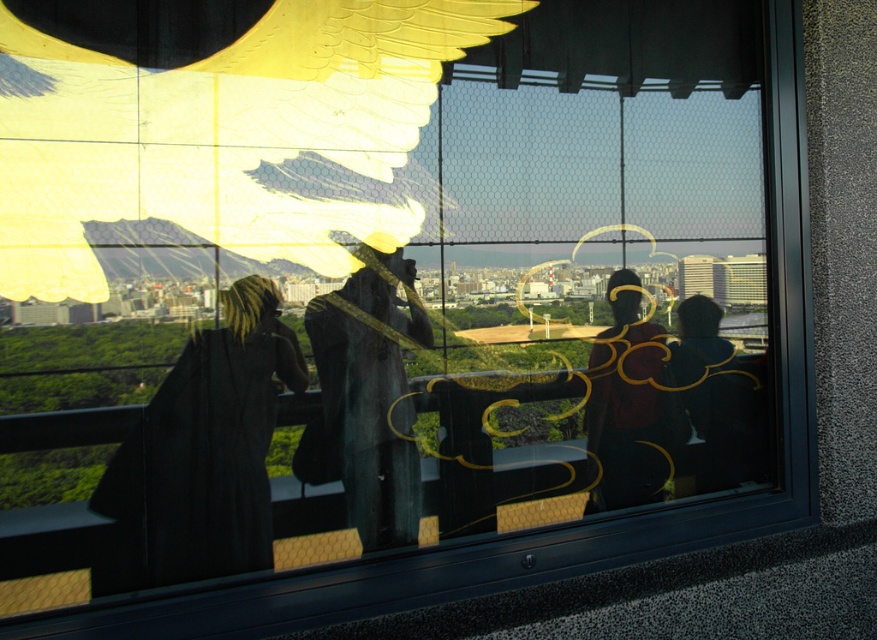
You are an interior designer assessing the space in the image. You need to ensure that a new ceiling fixture will not block the view of the golden textured wings at upper center and the black matte jacket at right. Given their heights, which object might require the fixture to be placed higher to avoid obstruction?

The golden textured wings at upper center is much taller than the black matte jacket at right, so the ceiling fixture should be placed higher to avoid blocking the view of the golden textured wings at upper center.

You are an interior designer assessing the window reflection. You need to determine if the golden textured wings at upper center can fit horizontally within the space occupied by the black matte jacket at right. Based on their widths, what is your conclusion?

The golden textured wings at upper center are wider than the black matte jacket at right, so they cannot fit horizontally within the space occupied by the black matte jacket at right.

You are an interior designer assessing the reflection in the window. You notice the matte black robe at center and the black matte jacket at right. Which one appears bigger in the reflection?

The matte black robe at center appears bigger in the reflection than the black matte jacket at right because it is larger in size.